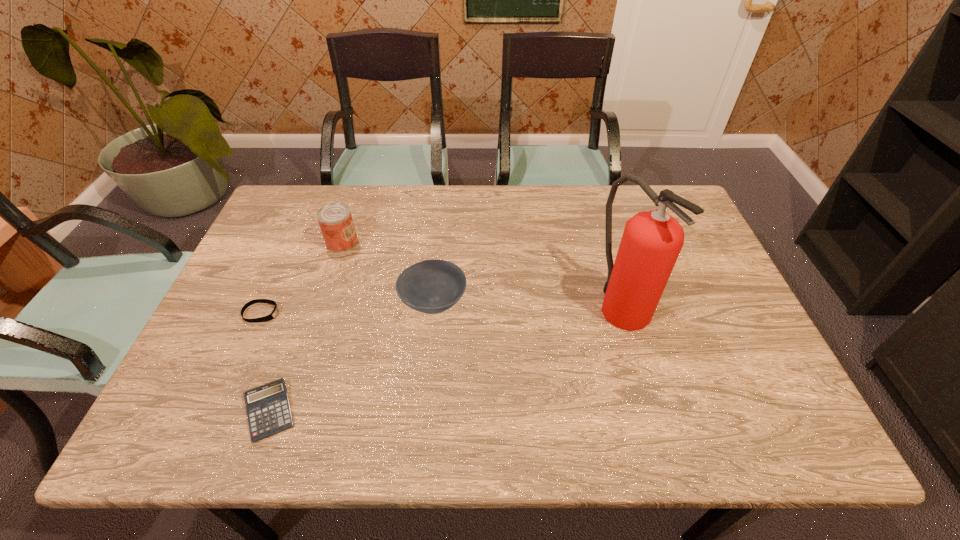
The height and width of the screenshot is (540, 960). In order to click on free space located on the right of the third tallest object in this screenshot , I will do `click(602, 302)`.

You are a GUI agent. You are given a task and a screenshot of the screen. Output one action in this format:
    pyautogui.click(x=<x>, y=<y>)
    Task: Click on the vacant space positioned 0.240m on the display of the wristband
    This screenshot has height=540, width=960.
    Given the screenshot: What is the action you would take?
    pyautogui.click(x=372, y=313)

Locate an element on the screen. This screenshot has height=540, width=960. vacant space situated on the back of the nearest object is located at coordinates (311, 295).

Where is `object that is at the near edge`? object that is at the near edge is located at coordinates (268, 409).

At what (x,y) coordinates should I click in order to perform the action: click on wristband located at the left edge. Please return your answer as a coordinate pair (x, y). The height and width of the screenshot is (540, 960). Looking at the image, I should click on [271, 316].

Where is `calculator situated at the left edge`? The image size is (960, 540). calculator situated at the left edge is located at coordinates (268, 409).

Where is `object at the near left corner`? Image resolution: width=960 pixels, height=540 pixels. object at the near left corner is located at coordinates click(x=268, y=409).

You are a GUI agent. You are given a task and a screenshot of the screen. Output one action in this format:
    pyautogui.click(x=<x>, y=<y>)
    Task: Click on the vacant point at the far edge
    The width and height of the screenshot is (960, 540).
    Given the screenshot: What is the action you would take?
    pyautogui.click(x=538, y=199)

The width and height of the screenshot is (960, 540). Identify the location of vacant area at the near edge of the desktop. (640, 410).

What are the coordinates of `vacant point at the left edge` in the screenshot? It's located at (277, 273).